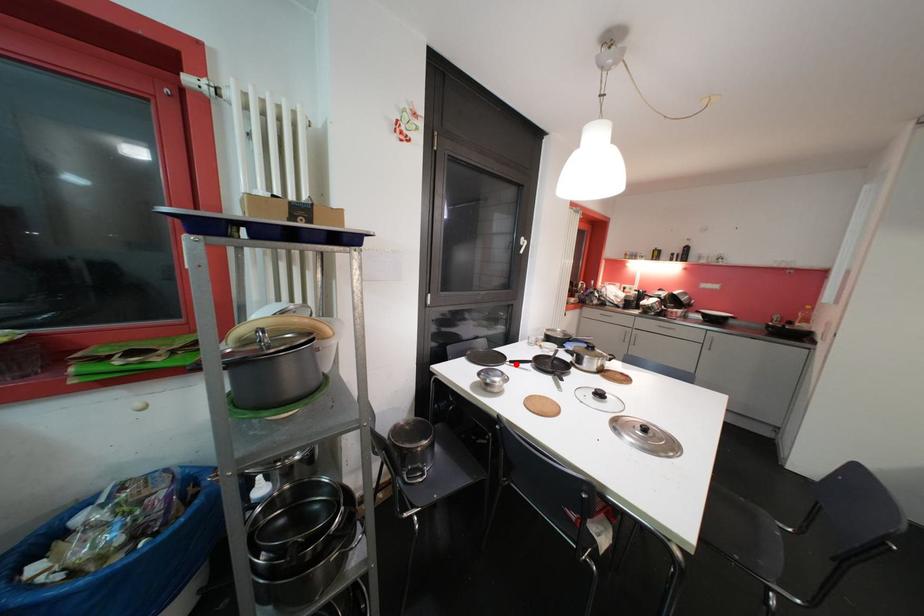
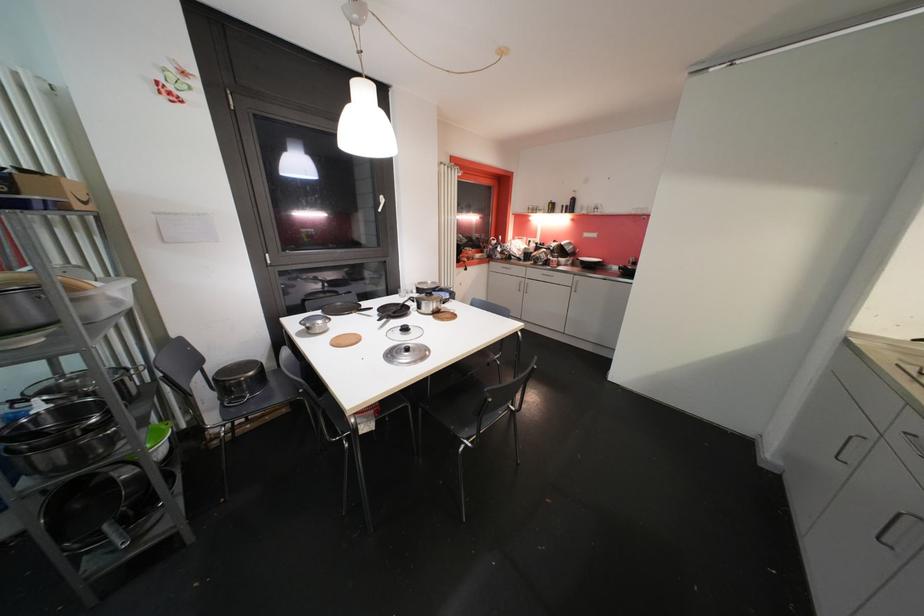
Question: I am providing you with two images of the same scene from different viewpoints. A red point is marked on the first image. Is the red point's position out of view in image 2?

Choices:
 (A) Yes
 (B) No

Answer: (A)